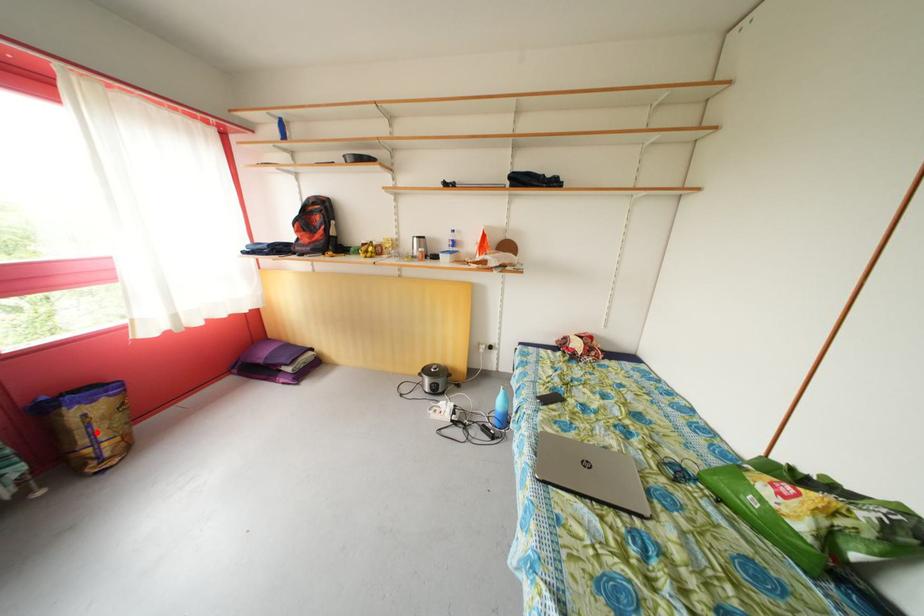
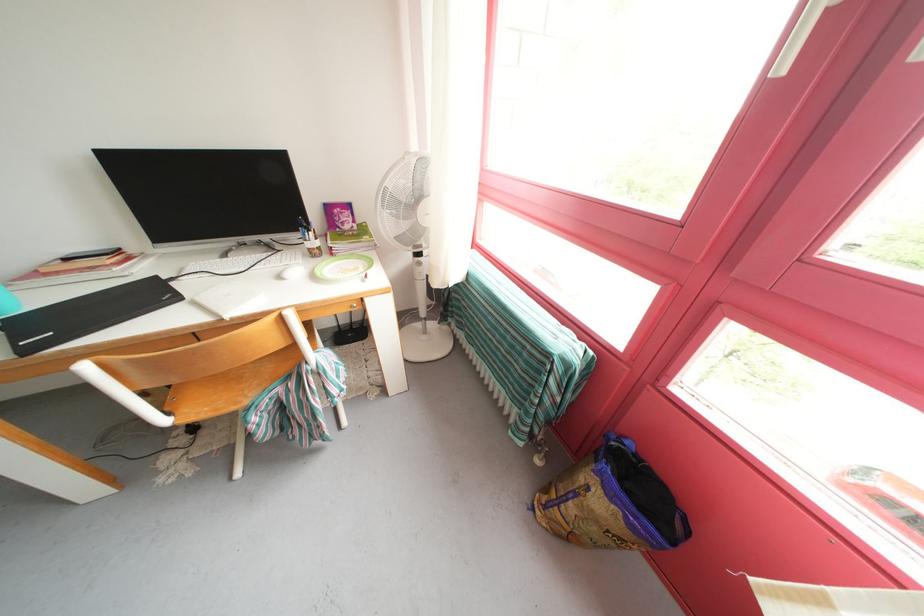
Find the pixel in the second image that matches the highlighted location in the first image.

(582, 499)